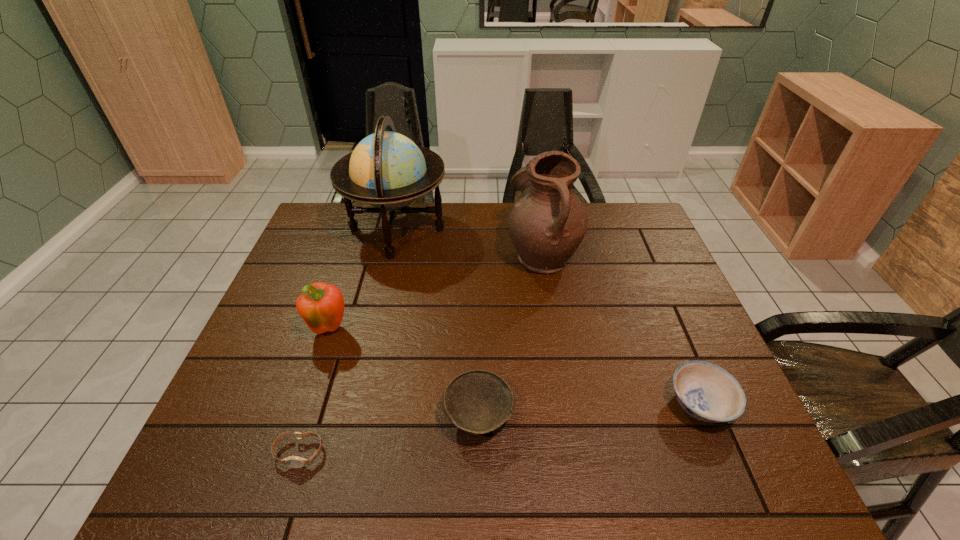
This screenshot has width=960, height=540. I want to click on globe that is at the left edge, so click(387, 170).

Find the location of a particular element. pepper located at the left edge is located at coordinates (321, 306).

Locate an element on the screen. watch at the left edge is located at coordinates (293, 461).

Identify the location of object that is at the right edge. (707, 392).

The height and width of the screenshot is (540, 960). I want to click on object that is at the far left corner, so coord(387,170).

Identify the location of object present at the near left corner. Image resolution: width=960 pixels, height=540 pixels. (293, 461).

Where is `vacant space at the far edge of the desktop`? vacant space at the far edge of the desktop is located at coordinates (588, 243).

This screenshot has height=540, width=960. I want to click on blank area at the near edge, so click(405, 480).

The width and height of the screenshot is (960, 540). I want to click on vacant region at the left edge, so click(x=289, y=318).

In the image, there is a desktop. Where is `vacant space at the right edge`? This screenshot has height=540, width=960. vacant space at the right edge is located at coordinates (687, 303).